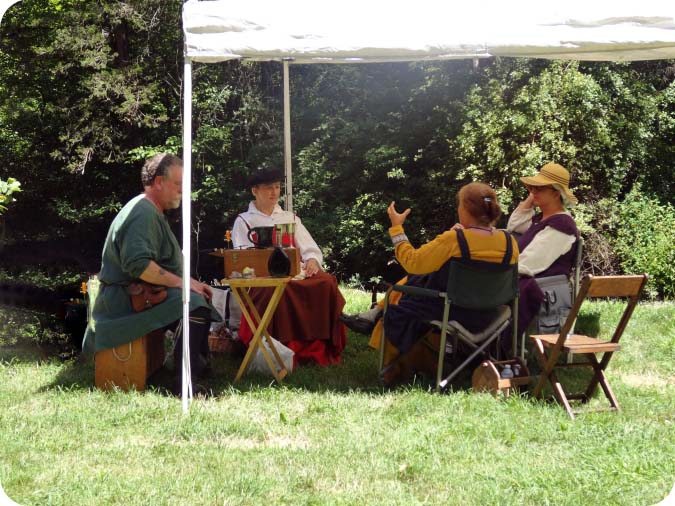
This screenshot has width=675, height=506. Identify the location of table. (262, 280).